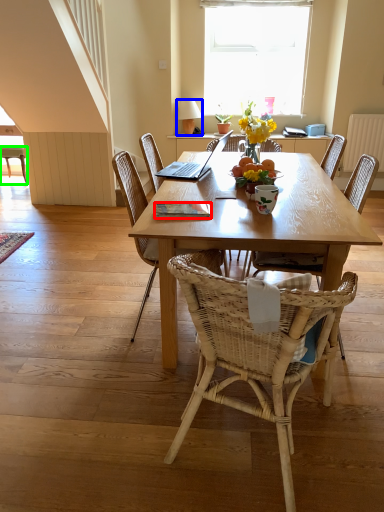
Question: Estimate the real-world distances between objects in this image. Which object is farther from book (highlighted by a red box), lamp (highlighted by a blue box) or chair (highlighted by a green box)?

Choices:
 (A) lamp
 (B) chair

Answer: (A)